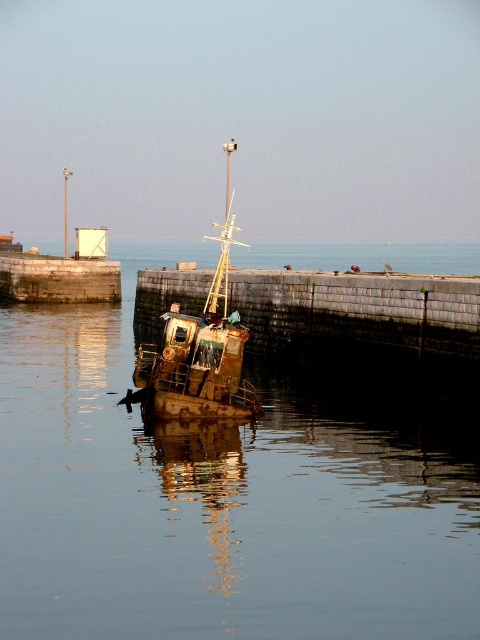
Is smooth water at center taller than rusty metal boat at center?

In fact, smooth water at center may be shorter than rusty metal boat at center.

Does smooth water at center appear over rusty metal boat at center?

No, smooth water at center is not above rusty metal boat at center.

Is point (276, 492) closer to camera compared to point (240, 410)?

Yes, it is in front of point (240, 410).

This screenshot has width=480, height=640. In order to click on smooth water at center in this screenshot , I will do `click(222, 499)`.